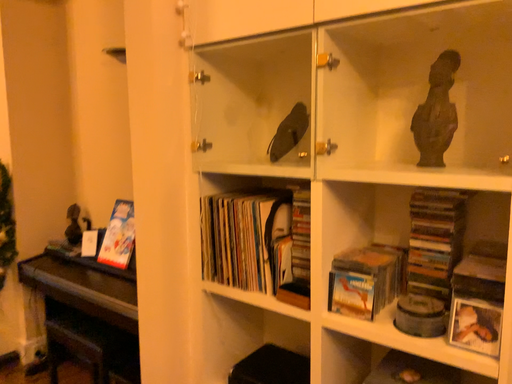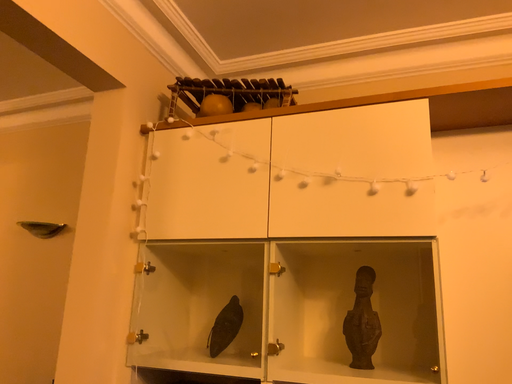
Question: How did the camera likely rotate when shooting the video?

Choices:
 (A) rotated downward
 (B) rotated upward

Answer: (B)